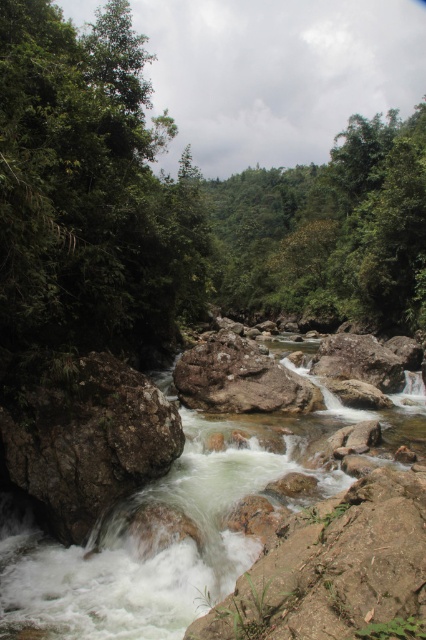
Question: Which object is farther from the camera taking this photo?

Choices:
 (A) rocky white water at center
 (B) brown rough rock at center
 (C) rough textured rock at center

Answer: (B)

Question: Is rocky white water at center further to camera compared to rough textured rock at center?

Choices:
 (A) yes
 (B) no

Answer: (B)

Question: Where is rocky white water at center located in relation to brown rough rock at center in the image?

Choices:
 (A) right
 (B) left

Answer: (B)

Question: Among these points, which one is farthest from the camera?

Choices:
 (A) 291,410
 (B) 196,582
 (C) 115,490

Answer: (A)

Question: Is rocky white water at center to the right of rough textured rock at center from the viewer's perspective?

Choices:
 (A) no
 (B) yes

Answer: (B)

Question: Based on their relative distances, which object is farther from the rough textured rock at center?

Choices:
 (A) brown rough rock at center
 (B) rocky white water at center

Answer: (A)